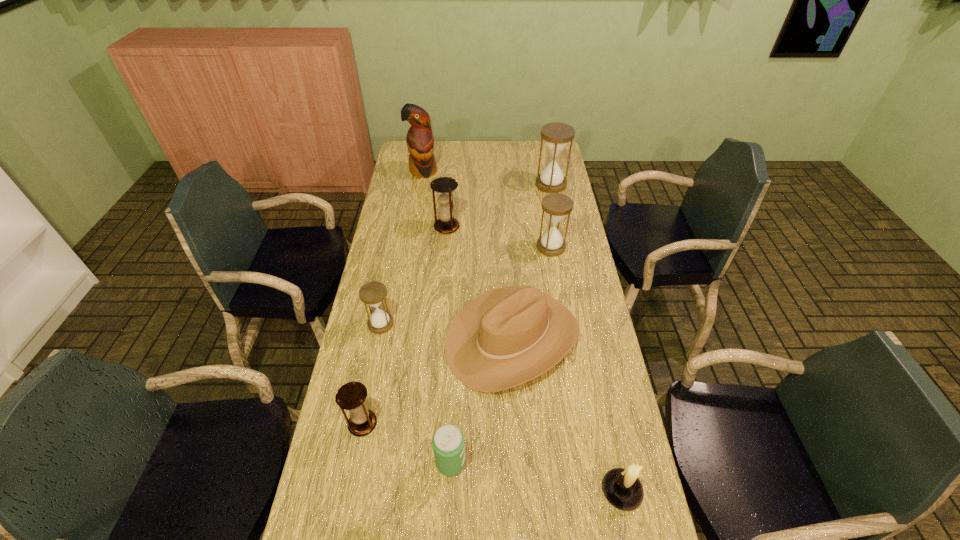
Find the location of a particular element. Image resolution: width=960 pixels, height=540 pixels. free space located 0.180m on the right of the smallest white hourglass is located at coordinates (447, 324).

This screenshot has height=540, width=960. What are the coordinates of `blank space located on the right of the left brown hourglass` in the screenshot? It's located at (499, 424).

In order to click on vacant space located 0.250m on the left of the candle holder in this screenshot , I will do `click(502, 490)`.

I want to click on free space located on the left of the soda, so click(x=413, y=462).

This screenshot has width=960, height=540. Identify the location of object that is at the far edge. (420, 142).

Where is `parrot located in the left edge section of the desktop`? parrot located in the left edge section of the desktop is located at coordinates (420, 142).

Locate an element on the screen. This screenshot has height=540, width=960. cowboy hat positioned at the right edge is located at coordinates (507, 336).

Image resolution: width=960 pixels, height=540 pixels. In order to click on candle holder that is at the right edge in this screenshot , I will do (x=622, y=488).

This screenshot has height=540, width=960. Find the location of `object situated at the far left corner`. object situated at the far left corner is located at coordinates (420, 142).

I want to click on vacant area at the far edge of the desktop, so click(437, 158).